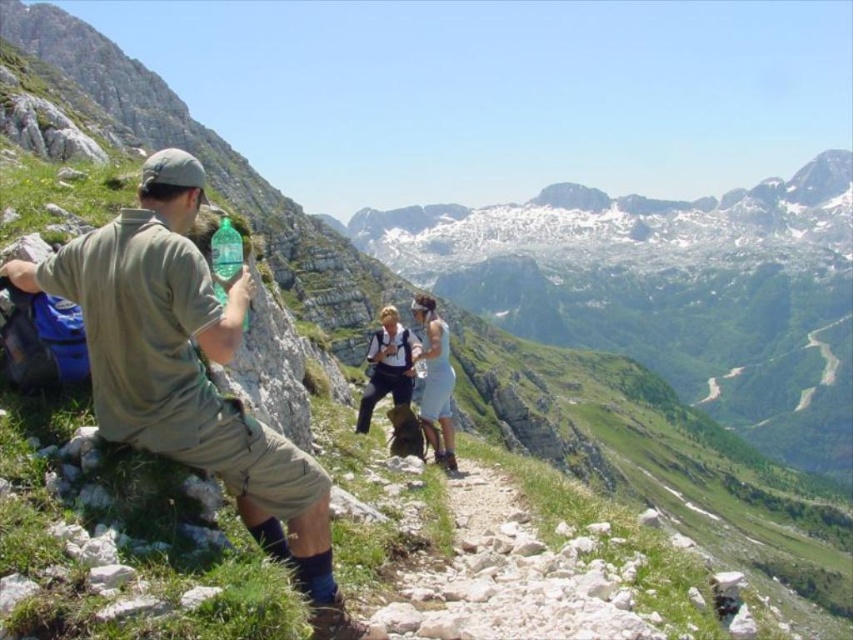
Question: Among these objects, which one is farthest from the camera?

Choices:
 (A) white fabric backpack at center
 (B) light blue fabric dress at center

Answer: (A)

Question: Does light blue fabric dress at center come behind white fabric backpack at center?

Choices:
 (A) yes
 (B) no

Answer: (B)

Question: Estimate the real-world distances between objects in this image. Which object is closer to the white fabric backpack at center?

Choices:
 (A) matte green t-shirt at left
 (B) light blue fabric dress at center

Answer: (B)

Question: Is light blue fabric dress at center to the left of white fabric backpack at center from the viewer's perspective?

Choices:
 (A) yes
 (B) no

Answer: (B)

Question: Which object appears farthest from the camera in this image?

Choices:
 (A) matte green t-shirt at left
 (B) light blue fabric dress at center

Answer: (B)

Question: Does matte green t-shirt at left appear on the left side of white fabric backpack at center?

Choices:
 (A) no
 (B) yes

Answer: (B)